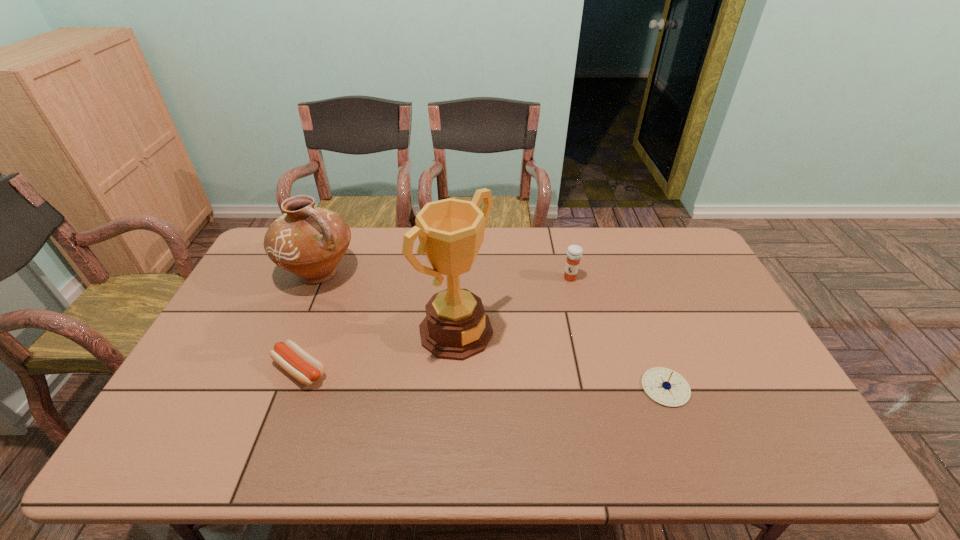
Identify the location of the shortest object. The width and height of the screenshot is (960, 540). (302, 366).

At what (x,y) coordinates should I click in order to perform the action: click on the fourth tallest object. Please return your answer as a coordinate pair (x, y). This screenshot has width=960, height=540. Looking at the image, I should click on (665, 386).

Where is `compass`? The width and height of the screenshot is (960, 540). compass is located at coordinates (665, 386).

Locate an element on the screen. This screenshot has height=540, width=960. pottery is located at coordinates click(x=308, y=241).

This screenshot has width=960, height=540. I want to click on the third object from right to left, so click(x=451, y=231).

You are a GUI agent. You are given a task and a screenshot of the screen. Output one action in this format:
    pyautogui.click(x=<x>, y=<y>)
    Task: Click on the tallest object
    
    Given the screenshot: What is the action you would take?
    pyautogui.click(x=451, y=231)

The height and width of the screenshot is (540, 960). In order to click on medicine in this screenshot , I will do `click(574, 253)`.

The height and width of the screenshot is (540, 960). I want to click on the second object from right to left, so click(574, 253).

The image size is (960, 540). I want to click on free point located on the back of the sausage, so click(339, 267).

Where is `vacant area located 0.120m on the back of the fourth tallest object`? The image size is (960, 540). vacant area located 0.120m on the back of the fourth tallest object is located at coordinates (646, 335).